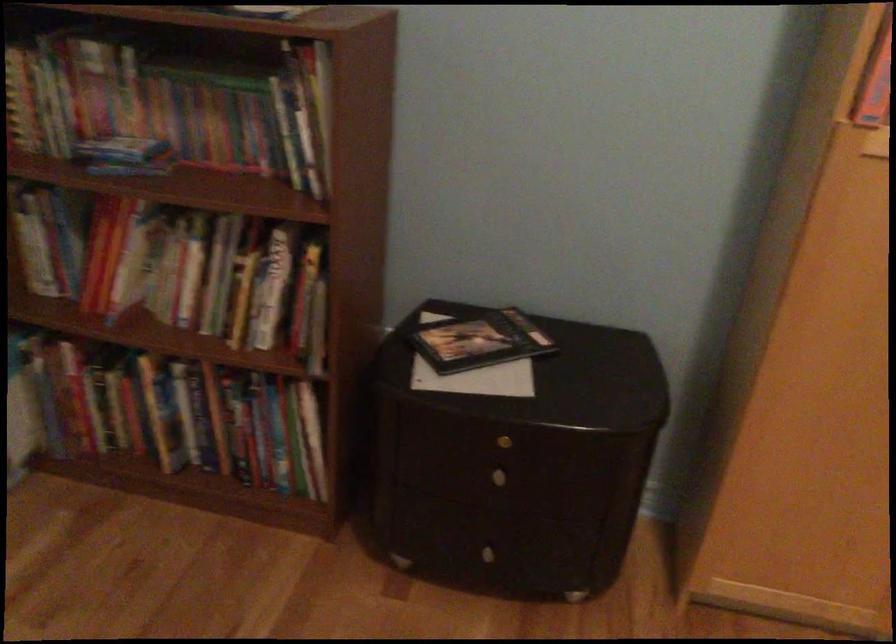
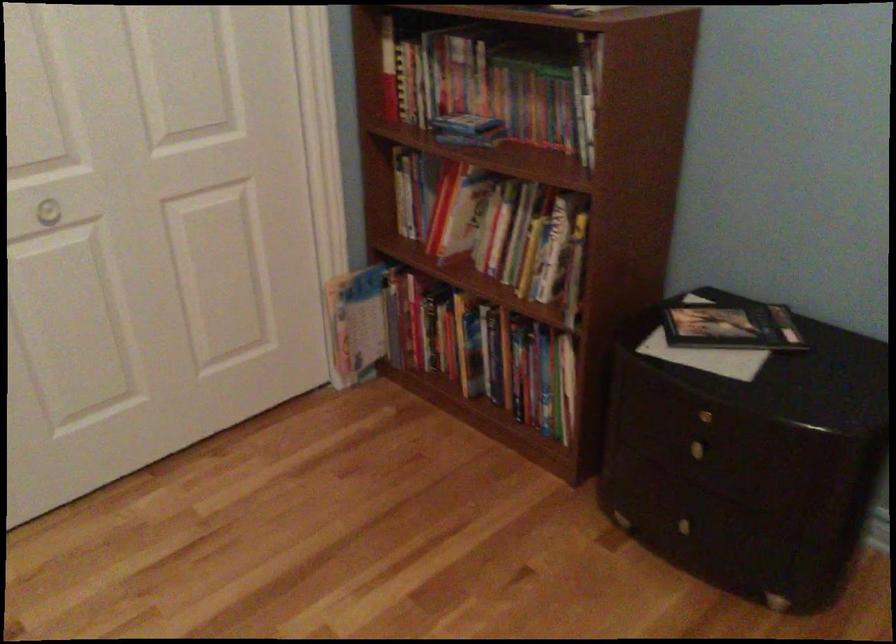
Locate, in the second image, the point that corresponds to point (226, 288) in the first image.

(518, 243)